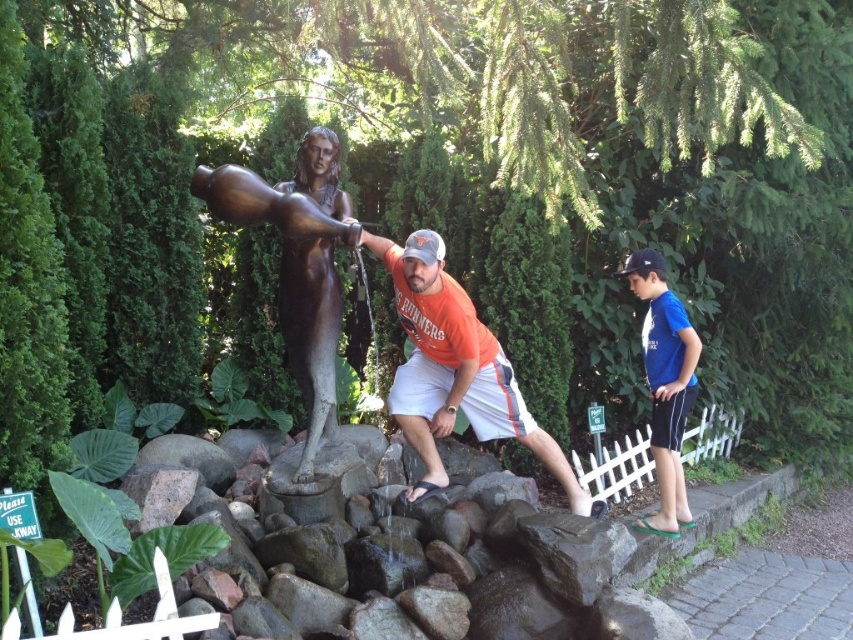
Which is more to the right, bronze statue at center or blue fabric shorts at right?

blue fabric shorts at right

Can you confirm if bronze statue at center is shorter than blue fabric shorts at right?

No, bronze statue at center is not shorter than blue fabric shorts at right.

What are the coordinates of `bronze statue at center` in the screenshot? It's located at (297, 262).

Which of these two, matte bronze statue at center or bronze statue at center, stands shorter?

Standing shorter between the two is matte bronze statue at center.

Is point (426, 308) closer to viewer compared to point (312, 332)?

No, it is not.

Identify the location of matte bronze statue at center. The width and height of the screenshot is (853, 640). (456, 369).

Who is positioned more to the right, matte bronze statue at center or blue fabric shorts at right?

blue fabric shorts at right

Can you confirm if matte bronze statue at center is positioned below blue fabric shorts at right?

Yes.

You are a GUI agent. You are given a task and a screenshot of the screen. Output one action in this format:
    pyautogui.click(x=<x>, y=<y>)
    Task: Click on the matte bronze statue at center
    The height and width of the screenshot is (640, 853).
    Given the screenshot: What is the action you would take?
    pyautogui.click(x=456, y=369)